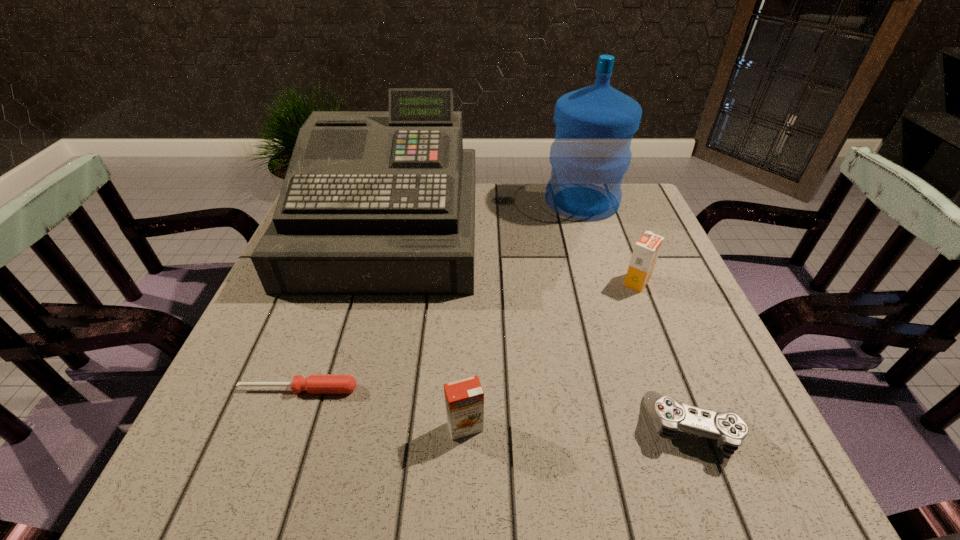
In order to click on the tallest object in this screenshot , I will do `click(591, 152)`.

This screenshot has width=960, height=540. I want to click on cash register, so click(373, 202).

Image resolution: width=960 pixels, height=540 pixels. I want to click on the right orange juice, so [x=646, y=250].

Locate an element on the screen. This screenshot has height=540, width=960. the nearer orange juice is located at coordinates (464, 399).

Where is `control`? control is located at coordinates (668, 415).

Where is `the shortest object`? This screenshot has height=540, width=960. the shortest object is located at coordinates (315, 384).

The image size is (960, 540). What are the coordinates of `vacant space located on the front of the tallest object` in the screenshot? It's located at (614, 302).

At what (x,y) coordinates should I click in order to perform the action: click on free space located on the front-facing side of the fifth shortest object. Please return your answer as a coordinate pair (x, y). This screenshot has height=540, width=960. Looking at the image, I should click on [x=360, y=334].

The image size is (960, 540). In order to click on vacant point located on the back of the right orange juice in this screenshot , I will do `click(626, 253)`.

Identify the location of vacant space located on the right of the left orange juice. The width and height of the screenshot is (960, 540). (526, 427).